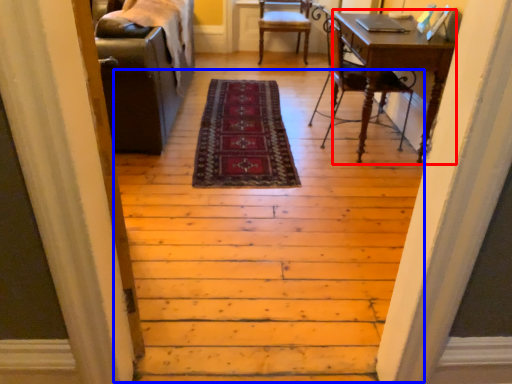
Question: Which point is further to the camera, computer desk (highlighted by a red box) or stairwell (highlighted by a blue box)?

Choices:
 (A) computer desk
 (B) stairwell

Answer: (A)